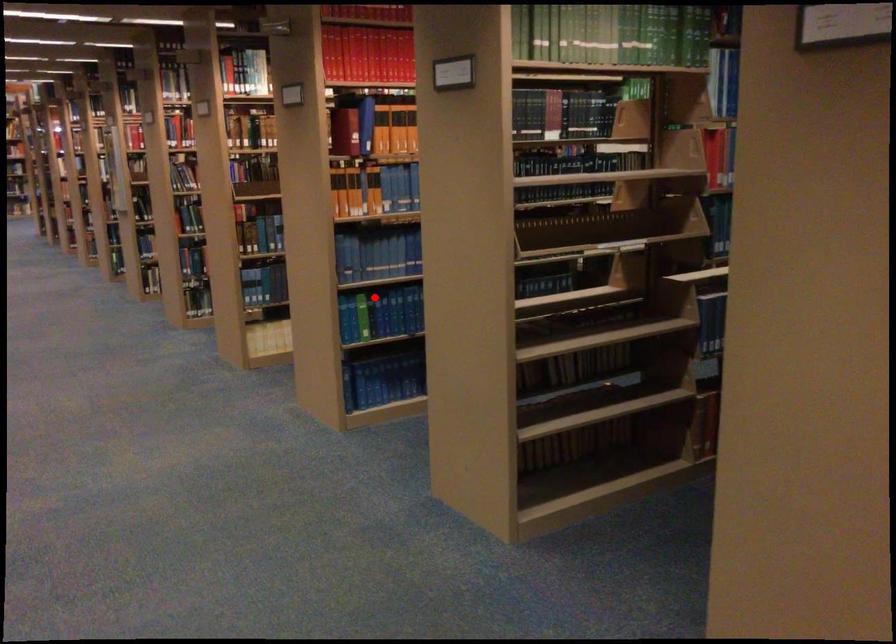
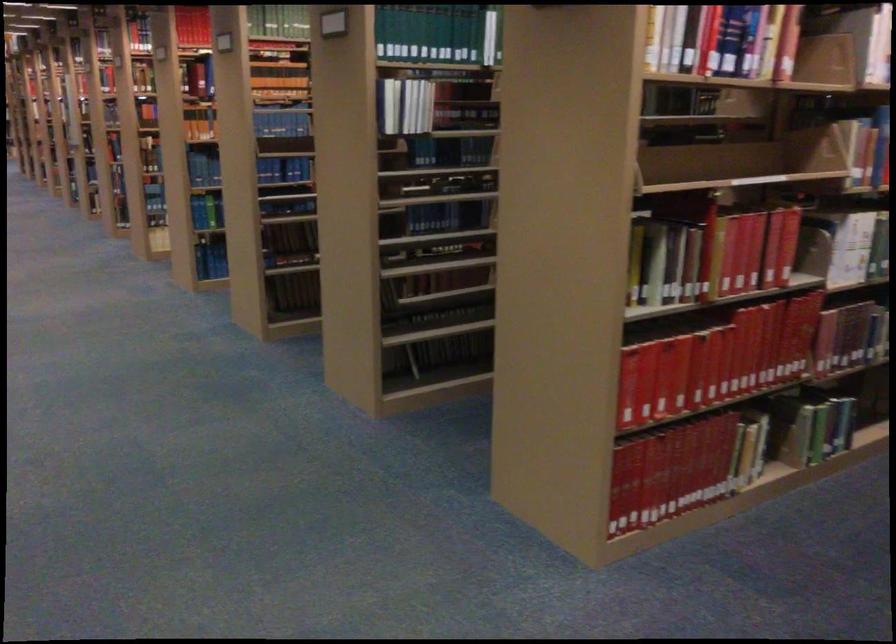
Find the pixel in the second image that matches the highlighted location in the first image.

(211, 212)